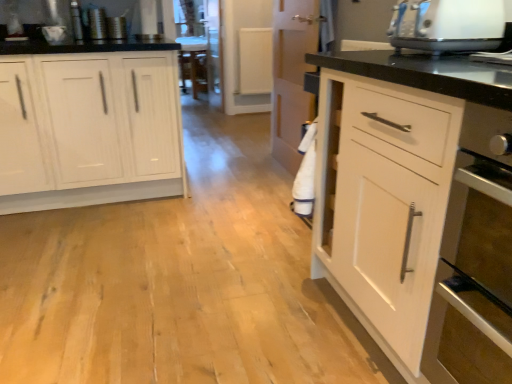
Question: Is white wood cabinet at left situated inside white plastic toaster at upper right or outside?

Choices:
 (A) outside
 (B) inside

Answer: (A)

Question: Is white wood cabinet at left taller or shorter than white plastic toaster at upper right?

Choices:
 (A) tall
 (B) short

Answer: (A)

Question: From a real-world perspective, is white wood cabinet at left above or below white plastic toaster at upper right?

Choices:
 (A) below
 (B) above

Answer: (A)

Question: From the image's perspective, is white plastic toaster at upper right above or below white wood cabinet at left?

Choices:
 (A) above
 (B) below

Answer: (A)

Question: Is white plastic toaster at upper right in front of or behind white wood cabinet at left in the image?

Choices:
 (A) behind
 (B) front

Answer: (B)

Question: From a real-world perspective, relative to white wood cabinet at left, is white plastic toaster at upper right vertically above or below?

Choices:
 (A) above
 (B) below

Answer: (A)

Question: In terms of width, does white plastic toaster at upper right look wider or thinner when compared to white wood cabinet at left?

Choices:
 (A) wide
 (B) thin

Answer: (B)